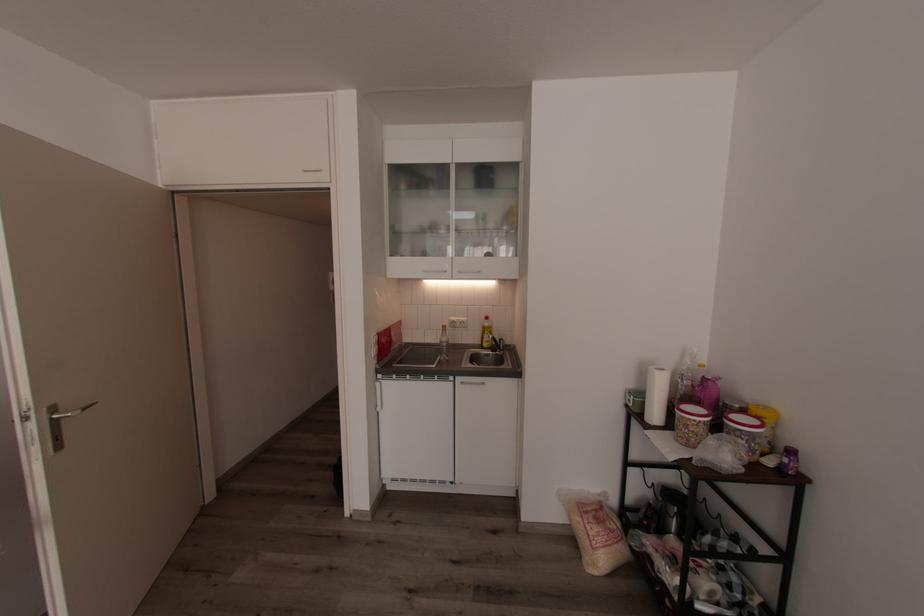
You are a GUI agent. You are given a task and a screenshot of the screen. Output one action in this format:
    pyautogui.click(x=<x>, y=<y>)
    Task: Click on the yellow plastic bottle
    
    Given the screenshot: What is the action you would take?
    pyautogui.click(x=766, y=422)